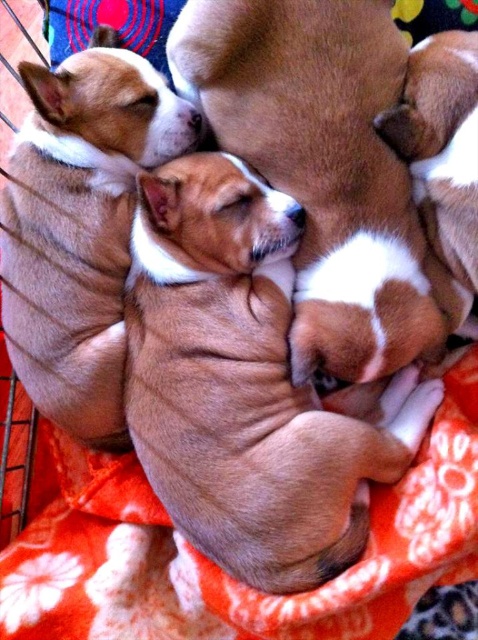
Who is more forward, (x=143, y=616) or (x=406, y=84)?

Point (x=406, y=84) is in front.

Can you confirm if orange floral blanket at center is bigger than brown soft fur at upper right?

Correct, orange floral blanket at center is larger in size than brown soft fur at upper right.

Locate an element on the screen. Image resolution: width=478 pixels, height=640 pixels. orange floral blanket at center is located at coordinates (217, 566).

Which is in front, point (440, 392) or point (11, 266)?

Point (11, 266)

Locate an element on the screen. This screenshot has width=478, height=640. brown smooth fur at center is located at coordinates (245, 385).

Is point (182, 456) closer to camera compared to point (115, 136)?

Yes, point (182, 456) is closer to viewer.

The image size is (478, 640). In order to click on brown smooth fur at center in this screenshot , I will do pos(245,385).

Who is shorter, brown furry dog at center or brown soft fur at upper right?

Standing shorter between the two is brown soft fur at upper right.

Can you confirm if brown furry dog at center is smaller than brown soft fur at upper right?

Incorrect, brown furry dog at center is not smaller in size than brown soft fur at upper right.

Find the location of `brown furry dog at center`. brown furry dog at center is located at coordinates (325, 170).